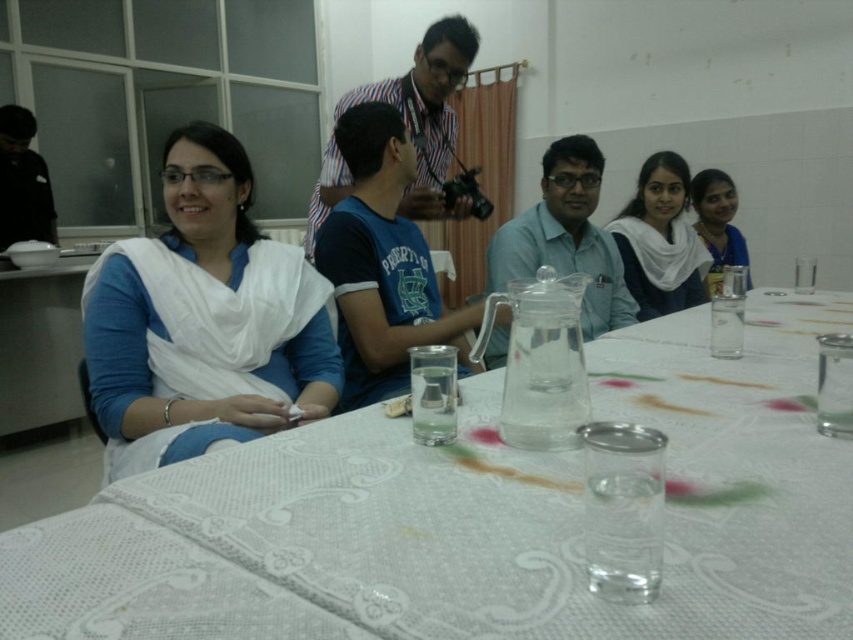
You are setting up a table for a small gathering and need to place a decorative item between the matte glass pitcher at center and the matte blue dress at upper right. Considering their sizes, which object should you place closer to the smaller one to balance the arrangement?

Since the matte glass pitcher at center is wider than the matte blue dress at upper right, you should place the decorative item closer to the matte blue dress at upper right to balance the arrangement.

You are standing at the point labeled as point (733, 250) and want to walk towards the point labeled as point (610, 305). According to the scene, which direction should you move relative to your current position?

You should move forward because point (610, 305) is in front of point (733, 250).

You are a photographer setting up for a group photo. You want to ensure that the matte glass pitcher at center and the matte blue dress at upper right are both visible in the frame. Based on their positions, which object is closer to the camera?

The matte glass pitcher at center is closer to the camera because it is positioned in front of the matte blue dress at upper right.